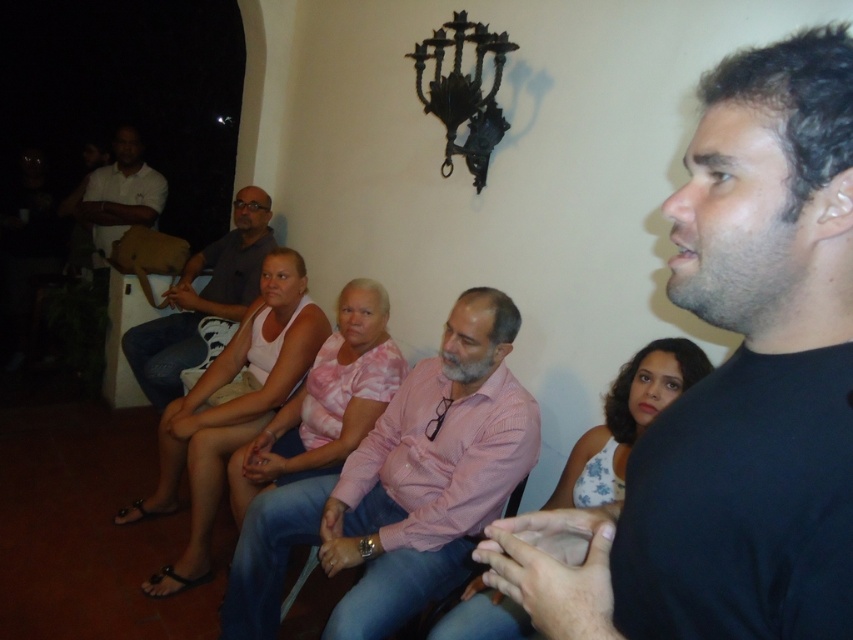
You are a photographer trying to capture a group photo of the people in the scene. You notice the pink striped shirt at center and the matte gray shirt at center. Which shirt should you adjust to ensure both are fully visible in the frame?

The pink striped shirt at center has a lesser height compared to matte gray shirt at center, so you should adjust the matte gray shirt at center to lower its height to match the pink striped shirt at center, ensuring both are fully visible in the frame.

You are standing in the room and want to reach the point marked as point (776, 230). If your reach extends 24 inches from your body, can you touch that point without moving your feet?

The distance between you and point (776, 230) is 24.84 inches. Since your reach is only 24 inches, you cannot touch the point without moving your feet.

You are attending a meeting in this room and need to identify the location of two participants based on their clothing. The participants are wearing a pink striped shirt at center and a white matte shirt at upper left. Which participant is positioned lower in the image?

The pink striped shirt at center is positioned lower than the white matte shirt at upper left because it is described as being below the white matte shirt at upper left.